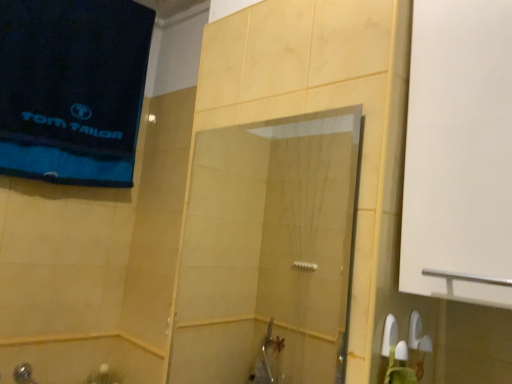
Question: Is shiny metallic showerhead at lower left thinner than blue cotton towel at upper left?

Choices:
 (A) yes
 (B) no

Answer: (A)

Question: Is shiny metallic showerhead at lower left with blue cotton towel at upper left?

Choices:
 (A) yes
 (B) no

Answer: (B)

Question: Is the position of shiny metallic showerhead at lower left less distant than that of blue cotton towel at upper left?

Choices:
 (A) yes
 (B) no

Answer: (B)

Question: Considering the relative positions of shiny metallic showerhead at lower left and blue cotton towel at upper left in the image provided, is shiny metallic showerhead at lower left to the left of blue cotton towel at upper left from the viewer's perspective?

Choices:
 (A) yes
 (B) no

Answer: (A)

Question: Considering the relative positions of shiny metallic showerhead at lower left and blue cotton towel at upper left in the image provided, is shiny metallic showerhead at lower left to the right of blue cotton towel at upper left from the viewer's perspective?

Choices:
 (A) no
 (B) yes

Answer: (A)

Question: In the image, is blue cotton towel at upper left on the left side or the right side of shiny metallic showerhead at lower left?

Choices:
 (A) right
 (B) left

Answer: (A)

Question: Considering the positions of point (138, 120) and point (31, 380), is point (138, 120) closer or farther from the camera than point (31, 380)?

Choices:
 (A) farther
 (B) closer

Answer: (A)

Question: Which is correct: blue cotton towel at upper left is inside shiny metallic showerhead at lower left, or outside of it?

Choices:
 (A) outside
 (B) inside

Answer: (A)

Question: From the image's perspective, is blue cotton towel at upper left positioned above or below shiny metallic showerhead at lower left?

Choices:
 (A) below
 (B) above

Answer: (B)

Question: Is transparent glass shower door at center inside or outside of blue cotton towel at upper left?

Choices:
 (A) inside
 (B) outside

Answer: (B)

Question: Looking at their shapes, would you say transparent glass shower door at center is wider or thinner than blue cotton towel at upper left?

Choices:
 (A) thin
 (B) wide

Answer: (A)

Question: From the image's perspective, relative to blue cotton towel at upper left, is transparent glass shower door at center above or below?

Choices:
 (A) below
 (B) above

Answer: (A)

Question: Considering the positions of point (230, 327) and point (81, 82), is point (230, 327) closer or farther from the camera than point (81, 82)?

Choices:
 (A) farther
 (B) closer

Answer: (A)

Question: In the image, is transparent glass shower door at center positioned in front of or behind shiny metallic showerhead at lower left?

Choices:
 (A) front
 (B) behind

Answer: (A)

Question: Is point (196, 153) positioned closer to the camera than point (16, 380)?

Choices:
 (A) closer
 (B) farther

Answer: (B)